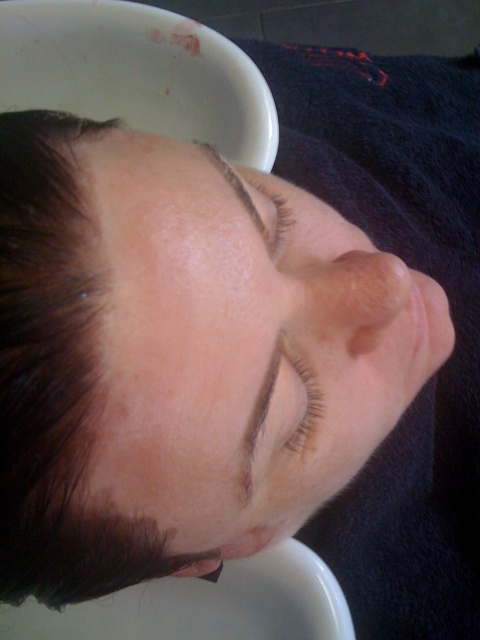
Question: Does smooth skin at center appear over brown hair at upper center?

Choices:
 (A) yes
 (B) no

Answer: (B)

Question: Which object appears farthest from the camera in this image?

Choices:
 (A) brown matte eye at center
 (B) brown matte eyelashes at upper center
 (C) dark brown hair at upper center
 (D) smooth skin at center

Answer: (B)

Question: Which of the following is the closest to the observer?

Choices:
 (A) (296, 346)
 (B) (244, 452)

Answer: (B)

Question: Which point is farther to the camera?

Choices:
 (A) dark brown hair at upper center
 (B) brown matte eyelashes at upper center
 (C) dark brown hair at upper left

Answer: (B)

Question: In this image, where is smooth skin at center located relative to brown matte eyelashes at upper center?

Choices:
 (A) above
 (B) below

Answer: (B)

Question: Does dark brown hair at upper center appear on the left side of brown hair at upper center?

Choices:
 (A) yes
 (B) no

Answer: (B)